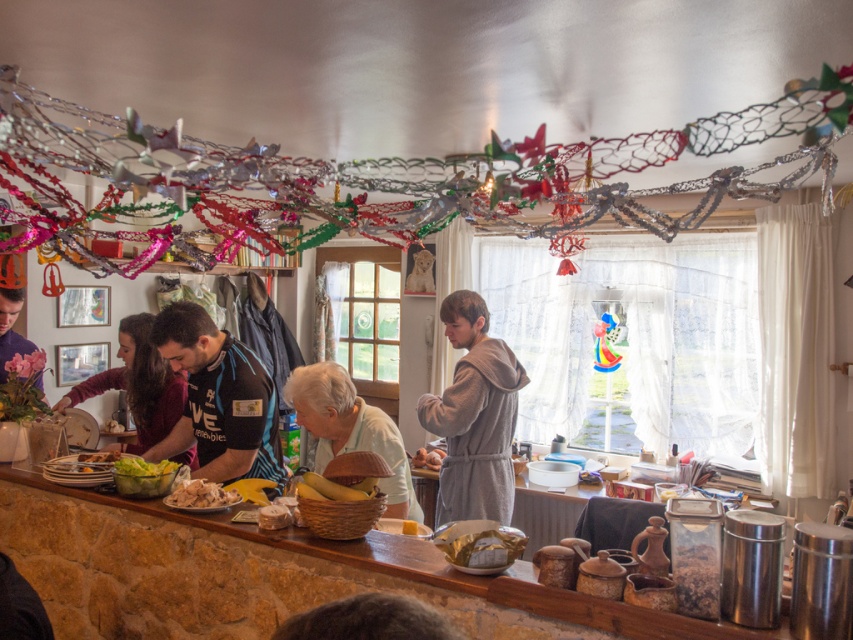
Question: Which object is farther from the camera taking this photo?

Choices:
 (A) brown matte eggs at center
 (B) yellow matte bananas at center
 (C) green leafy salad at center
 (D) white textured sweater at center

Answer: (A)

Question: Which point is closer to the camera?

Choices:
 (A) brown matte eggs at center
 (B) yellow matte cheese at center

Answer: (B)

Question: Is matte black laptop at left above brown matte eggs at center?

Choices:
 (A) yes
 (B) no

Answer: (A)

Question: Is shiny metallic garland at upper center to the left of green leafy salad at center from the viewer's perspective?

Choices:
 (A) no
 (B) yes

Answer: (A)

Question: Is yellow matte bananas at center thinner than smooth brown bread at lower left?

Choices:
 (A) yes
 (B) no

Answer: (A)

Question: Which of the following is the farthest from the observer?

Choices:
 (A) white crumbly bread at lower center
 (B) smooth brown bread at lower left

Answer: (B)